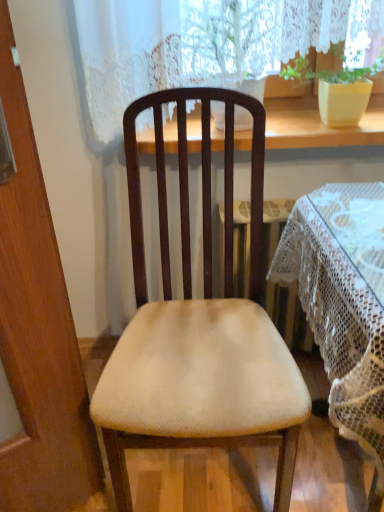
The width and height of the screenshot is (384, 512). What do you see at coordinates (338, 89) in the screenshot?
I see `matte yellow pot at upper right` at bounding box center [338, 89].

Identify the location of wooden at upper center. The height and width of the screenshot is (512, 384). (318, 125).

The image size is (384, 512). I want to click on matte yellow pot at upper right, so click(338, 89).

Does beige fabric chair at center turn towards matte yellow pot at upper right?

No, beige fabric chair at center is not aimed at matte yellow pot at upper right.

From a real-world perspective, is beige fabric chair at center over matte yellow pot at upper right?

No, from a real-world perspective, beige fabric chair at center is not above matte yellow pot at upper right.

Is beige fabric chair at center spatially inside matte yellow pot at upper right, or outside of it?

beige fabric chair at center cannot be found inside matte yellow pot at upper right.

Does white lace tablecloth at center have a lesser width compared to beige fabric chair at center?

No.

From the image's perspective, is white lace tablecloth at center located above beige fabric chair at center?

No, from the image's perspective, white lace tablecloth at center is not over beige fabric chair at center.

Which of these two, white lace tablecloth at center or beige fabric chair at center, stands taller?

Standing taller between the two is beige fabric chair at center.

Is beige fabric chair at center at the back of white lace tablecloth at center?

No, white lace tablecloth at center is not facing away from beige fabric chair at center.

Is beige fabric chair at center turned away from white lace tablecloth at center?

No, beige fabric chair at center is not facing away from white lace tablecloth at center.

Considering the sizes of beige fabric chair at center and white lace tablecloth at center in the image, is beige fabric chair at center bigger or smaller than white lace tablecloth at center?

In the image, beige fabric chair at center appears to be smaller than white lace tablecloth at center.

Do you think beige fabric chair at center is within white lace tablecloth at center, or outside of it?

beige fabric chair at center is outside white lace tablecloth at center.

From a real-world perspective, which is physically above, white lace tablecloth at center or wooden at upper center?

wooden at upper center is physically above.

Who is taller, white lace tablecloth at center or wooden at upper center?

Standing taller between the two is white lace tablecloth at center.

From the picture: Is white lace tablecloth at center oriented away from wooden at upper center?

Yes, white lace tablecloth at center is positioned with its back facing wooden at upper center.

Can you confirm if wooden at upper center is shorter than matte yellow pot at upper right?

Indeed, wooden at upper center has a lesser height compared to matte yellow pot at upper right.

From the image's perspective, is wooden at upper center positioned above or below matte yellow pot at upper right?

wooden at upper center is situated lower than matte yellow pot at upper right in the image.

Does wooden at upper center appear on the left side of matte yellow pot at upper right?

Yes, wooden at upper center is to the left of matte yellow pot at upper right.

Is wooden at upper center oriented towards matte yellow pot at upper right?

No, wooden at upper center is not turned towards matte yellow pot at upper right.

How many degrees apart are the facing directions of matte yellow pot at upper right and beige fabric chair at center?

The angular difference between matte yellow pot at upper right and beige fabric chair at center is 0.604 degrees.

From the image's perspective, is matte yellow pot at upper right under beige fabric chair at center?

No, from the image's perspective, matte yellow pot at upper right is not beneath beige fabric chair at center.

Is matte yellow pot at upper right shorter than beige fabric chair at center?

Correct, matte yellow pot at upper right is not as tall as beige fabric chair at center.

Is point (341, 83) in front of point (163, 373)?

That is False.

Is wooden at upper center positioned far away from beige fabric chair at center?

No, wooden at upper center is not far away from beige fabric chair at center.

Is beige fabric chair at center located within wooden at upper center?

No, beige fabric chair at center is not inside wooden at upper center.

Which object is positioned more to the right, wooden at upper center or beige fabric chair at center?

wooden at upper center.

Which of these two, wooden at upper center or beige fabric chair at center, stands shorter?

wooden at upper center.

Locate an element on the screen. This screenshot has height=512, width=384. houseplant above the beige fabric chair at center (from the image's perspective) is located at coordinates (338, 89).

The image size is (384, 512). Find the location of `table in front of the beige fabric chair at center`. table in front of the beige fabric chair at center is located at coordinates (343, 303).

When comparing their distances from beige fabric chair at center, does wooden at upper center or white lace tablecloth at center seem closer?

white lace tablecloth at center lies closer to beige fabric chair at center than the other object.

Estimate the real-world distances between objects in this image. Which object is closer to white lace tablecloth at center, wooden at upper center or matte yellow pot at upper right?

Among the two, wooden at upper center is located nearer to white lace tablecloth at center.

Which object lies nearer to the anchor point beige fabric chair at center, white lace tablecloth at center or wooden at upper center?

The object closer to beige fabric chair at center is white lace tablecloth at center.

Looking at the image, which one is located further to wooden at upper center, white lace tablecloth at center or beige fabric chair at center?

white lace tablecloth at center lies further to wooden at upper center than the other object.

Which object lies further to the anchor point wooden at upper center, beige fabric chair at center or matte yellow pot at upper right?

beige fabric chair at center lies further to wooden at upper center than the other object.

Considering their positions, is matte yellow pot at upper right positioned closer to beige fabric chair at center than white lace tablecloth at center?

white lace tablecloth at center.

Based on their spatial positions, is matte yellow pot at upper right or wooden at upper center further from white lace tablecloth at center?

Among the two, matte yellow pot at upper right is located further to white lace tablecloth at center.

Considering their positions, is beige fabric chair at center positioned closer to wooden at upper center than white lace tablecloth at center?

beige fabric chair at center lies closer to wooden at upper center than the other object.

The image size is (384, 512). I want to click on chair located between white lace tablecloth at center and wooden at upper center in the depth direction, so click(199, 325).

Locate an element on the screen. houseplant between beige fabric chair at center and wooden at upper center along the z-axis is located at coordinates (338, 89).

Locate an element on the screen. This screenshot has height=512, width=384. window sill between matte yellow pot at upper right and white lace tablecloth at center vertically is located at coordinates coord(318,125).

In order to click on chair between matte yellow pot at upper right and white lace tablecloth at center in the vertical direction in this screenshot , I will do `click(199, 325)`.